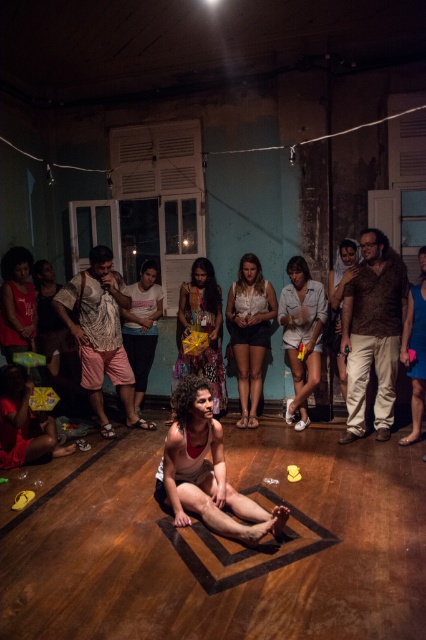
You are organizing a small event in this room and need to store the multicolored fabric bag at center and the matte red tank top at left. Which item can hold more items inside?

The multicolored fabric bag at center has a larger size compared to the matte red tank top at left, so it can hold more items inside.

You are a photographer trying to capture a candid shot of the brown furry shirt at right and the white matte shirt at center. Since the lighting is dim, you want to ensure both subjects are well lit. Which subject should you position closer to the light source to achieve better exposure?

The brown furry shirt at right is much taller than the white matte shirt at center, so positioning the shorter white matte shirt at center closer to the light source would help balance the exposure between both subjects.

You are an observer in the room. You notice two people wearing shirts. One is wearing a brown furry shirt at right and the other a white matte shirt at center. Which shirt is higher in position?

The brown furry shirt at right is located above the white matte shirt at center, so the brown furry shirt at right is higher in position.